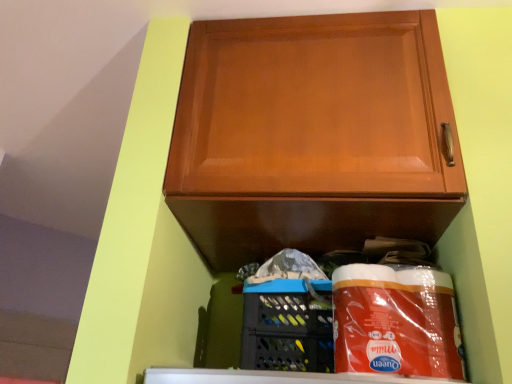
Question: Is glossy wood cabinet at upper center in front of or behind matte black basket at lower center in the image?

Choices:
 (A) front
 (B) behind

Answer: (A)

Question: Looking at their shapes, would you say glossy wood cabinet at upper center is wider or thinner than matte black basket at lower center?

Choices:
 (A) thin
 (B) wide

Answer: (B)

Question: From a real-world perspective, is glossy wood cabinet at upper center physically located above or below matte black basket at lower center?

Choices:
 (A) above
 (B) below

Answer: (A)

Question: Would you say matte black basket at lower center is inside or outside glossy wood cabinet at upper center?

Choices:
 (A) outside
 (B) inside

Answer: (A)

Question: Considering the positions of matte black basket at lower center and glossy wood cabinet at upper center in the image, is matte black basket at lower center taller or shorter than glossy wood cabinet at upper center?

Choices:
 (A) tall
 (B) short

Answer: (B)

Question: From a real-world perspective, relative to glossy wood cabinet at upper center, is matte black basket at lower center vertically above or below?

Choices:
 (A) above
 (B) below

Answer: (B)

Question: Visually, is matte black basket at lower center positioned to the left or to the right of glossy wood cabinet at upper center?

Choices:
 (A) right
 (B) left

Answer: (B)